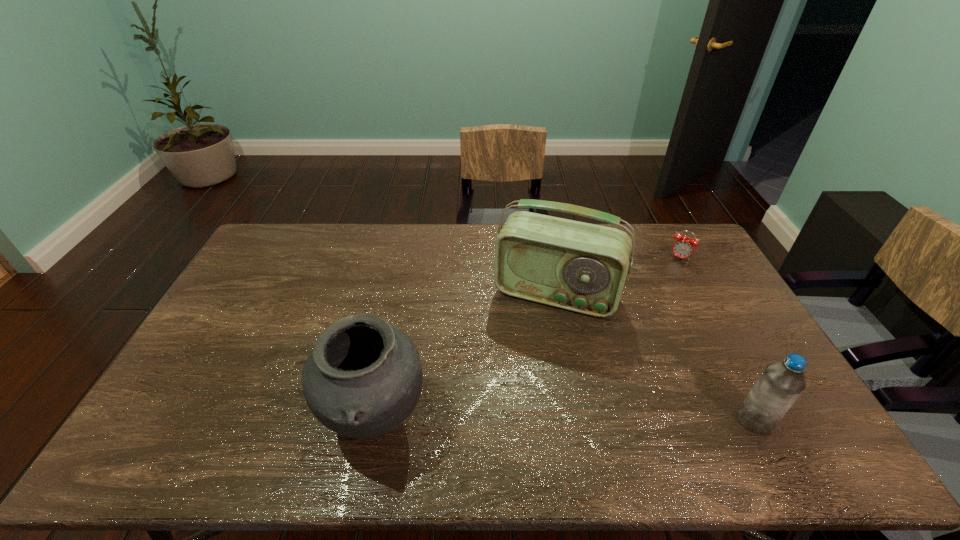
Find the location of a particular element. vacant space on the desktop that is between the leftmost object and the third tallest object and is positioned on the front panel of the radio receiver is located at coordinates (513, 420).

Locate an element on the screen. This screenshot has height=540, width=960. vacant space on the desktop that is between the second tallest object and the water bottle and is positioned on the face of the shortest object is located at coordinates (588, 420).